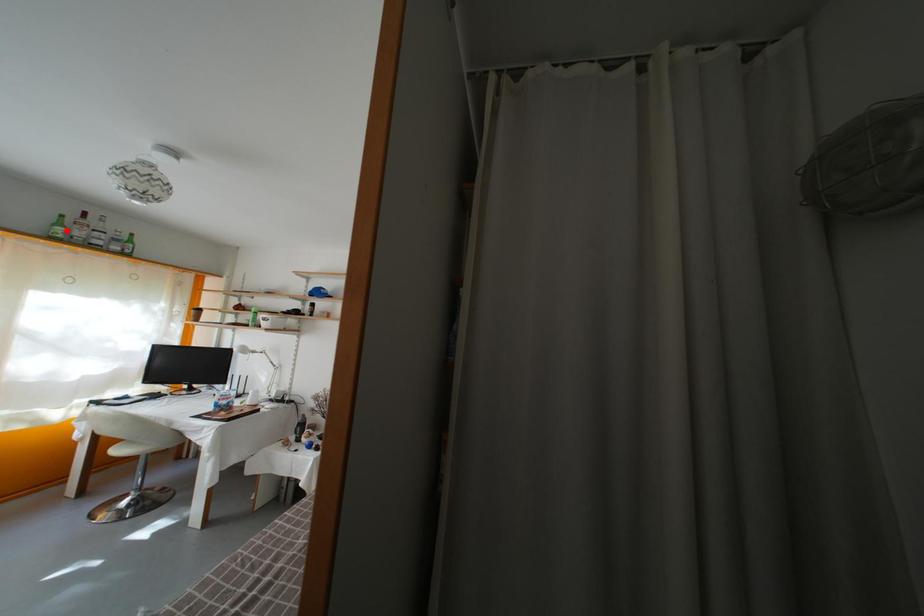
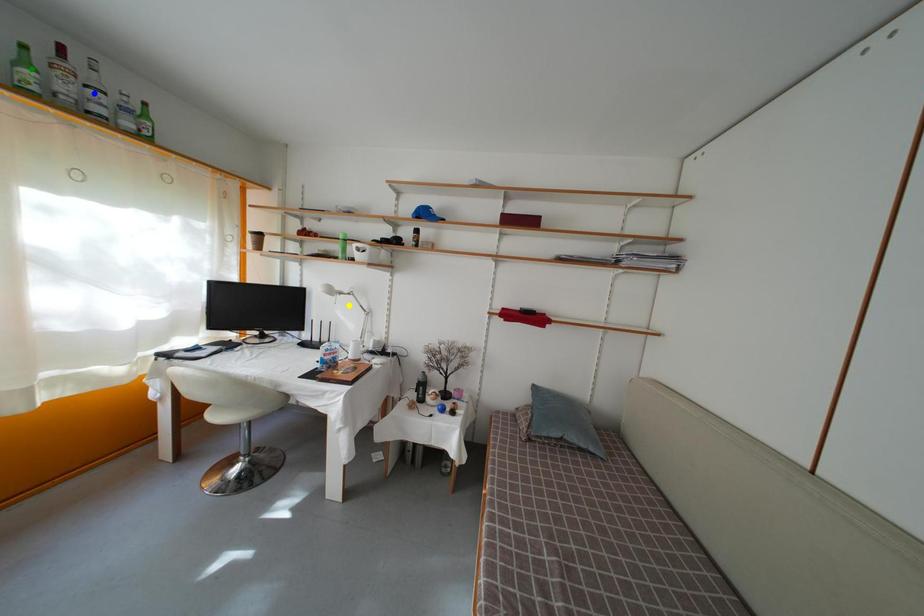
Question: I am providing you with two images of the same scene from different viewpoints. A red point is marked on the first image. You are given multiple points on the second image. In image 2, which mark is for the same physical point as the one in image 1?

Choices:
 (A) yellow point
 (B) blue point
 (C) green point

Answer: (C)